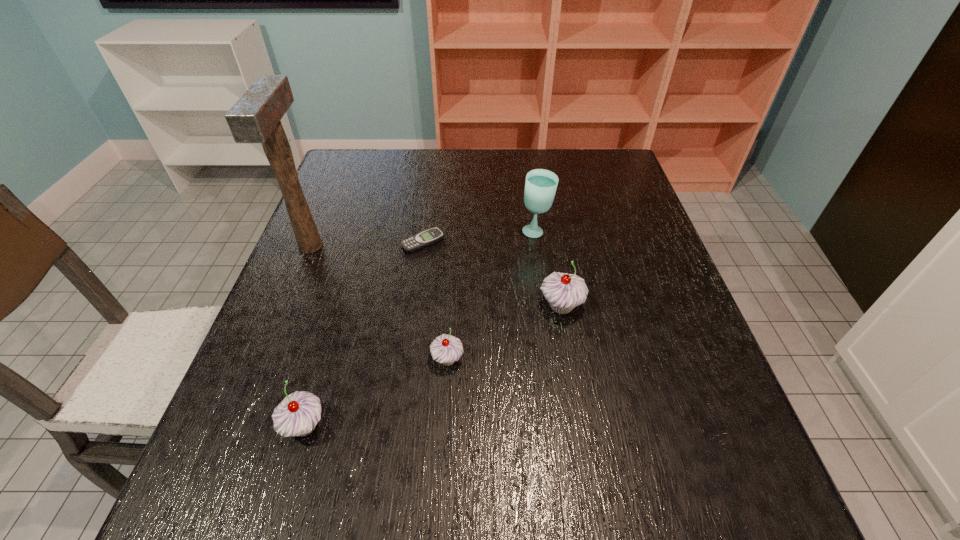
Considering the uniform spacing of cupcakes, where should an additional cupcake be positioned on the right? Please locate a free spot. Please provide its 2D coordinates. Your answer should be formatted as a tuple, i.e. [(x, y)], where the tuple contains the x and y coordinates of a point satisfying the conditions above.

[(654, 263)]